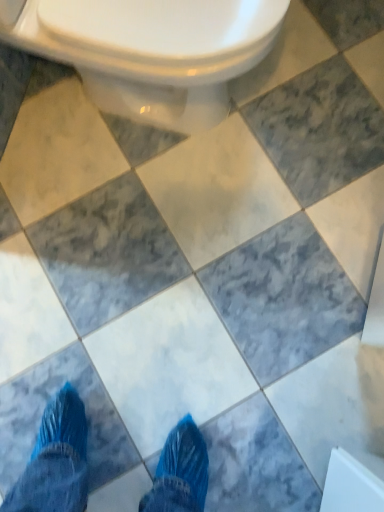
Where is `free space in front of white glossy toilet at upper center`? This screenshot has width=384, height=512. free space in front of white glossy toilet at upper center is located at coordinates (175, 244).